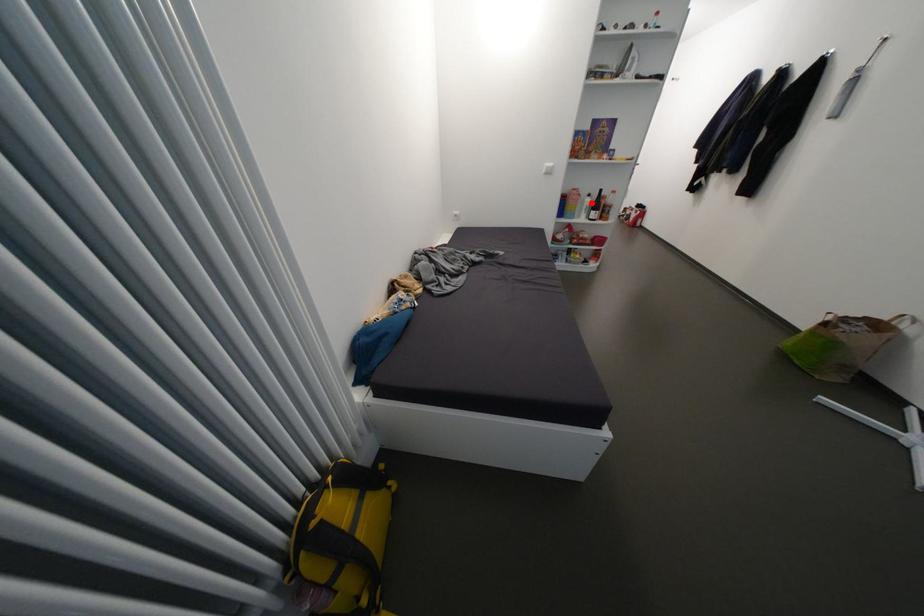
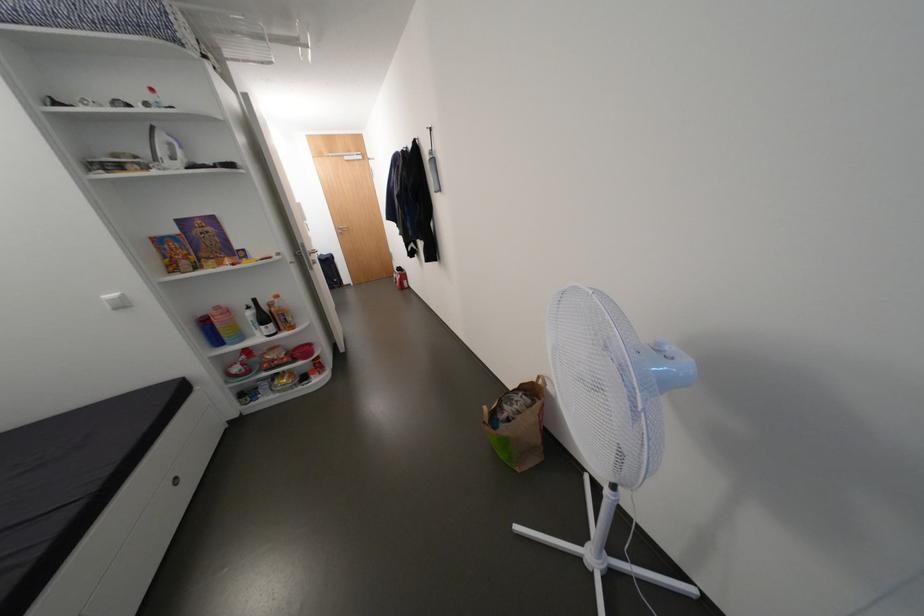
Find the pixel in the second image that matches the highlighted location in the first image.

(252, 318)